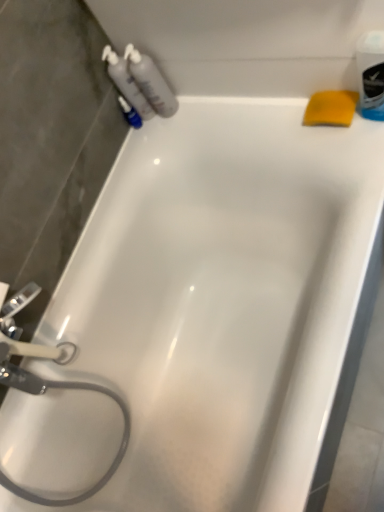
The width and height of the screenshot is (384, 512). I want to click on free space behind yellow sponge at upper right, so click(266, 113).